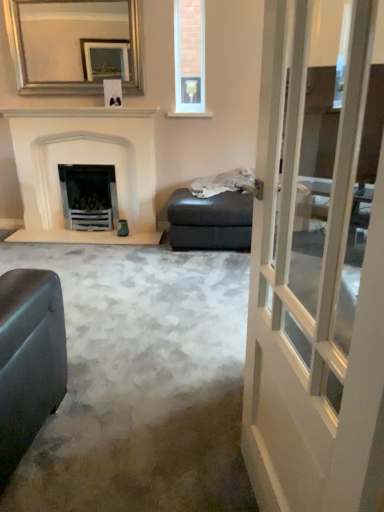
Question: Does matte gray footrest at center appear on the left side of clear glass wine glass at upper center?

Choices:
 (A) yes
 (B) no

Answer: (B)

Question: Is matte gray footrest at center facing towards clear glass wine glass at upper center?

Choices:
 (A) no
 (B) yes

Answer: (A)

Question: Can you confirm if matte gray footrest at center is thinner than clear glass wine glass at upper center?

Choices:
 (A) yes
 (B) no

Answer: (B)

Question: Is matte gray footrest at center not within clear glass wine glass at upper center?

Choices:
 (A) yes
 (B) no

Answer: (A)

Question: From a real-world perspective, is matte gray footrest at center positioned over clear glass wine glass at upper center based on gravity?

Choices:
 (A) no
 (B) yes

Answer: (A)

Question: Considering the relative sizes of matte gray footrest at center and clear glass wine glass at upper center in the image provided, is matte gray footrest at center wider than clear glass wine glass at upper center?

Choices:
 (A) yes
 (B) no

Answer: (A)

Question: Is silver metallic mirror at upper center at the back of white marble fireplace at left?

Choices:
 (A) yes
 (B) no

Answer: (B)

Question: Is white marble fireplace at left shorter than silver metallic mirror at upper center?

Choices:
 (A) no
 (B) yes

Answer: (A)

Question: Is white marble fireplace at left thinner than silver metallic mirror at upper center?

Choices:
 (A) yes
 (B) no

Answer: (B)

Question: Could silver metallic mirror at upper center be considered to be inside white marble fireplace at left?

Choices:
 (A) no
 (B) yes

Answer: (A)

Question: Is white marble fireplace at left bigger than silver metallic mirror at upper center?

Choices:
 (A) no
 (B) yes

Answer: (B)

Question: From a real-world perspective, is white marble fireplace at left located beneath silver metallic mirror at upper center?

Choices:
 (A) yes
 (B) no

Answer: (A)

Question: From a real-world perspective, is white glass door at center located beneath matte gray footrest at center?

Choices:
 (A) yes
 (B) no

Answer: (B)